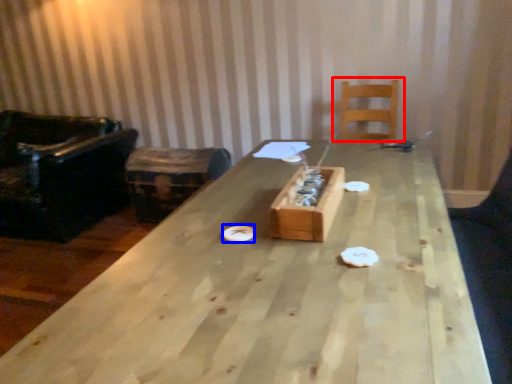
Question: Which object is closer to the camera taking this photo, chair (highlighted by a red box) or paper plate (highlighted by a blue box)?

Choices:
 (A) chair
 (B) paper plate

Answer: (B)